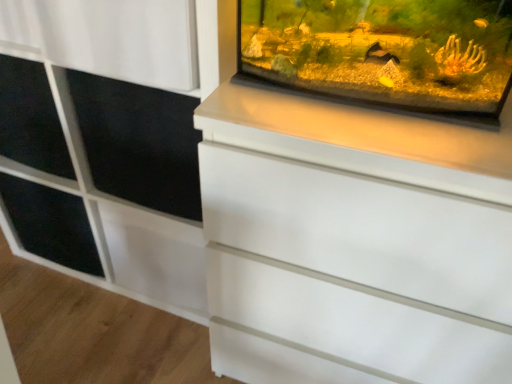
Find the location of a particular element. Image resolution: width=512 pixels, height=384 pixels. black matte shelf at left is located at coordinates (50, 224).

From the image's perspective, is transparent glass tank at upper right located above or below black matte shelf at left?

transparent glass tank at upper right is situated higher than black matte shelf at left in the image.

Is transparent glass tank at upper right further to camera compared to black matte shelf at left?

No, the depth of transparent glass tank at upper right is less than that of black matte shelf at left.

In terms of size, does transparent glass tank at upper right appear bigger or smaller than black matte shelf at left?

transparent glass tank at upper right is smaller than black matte shelf at left.

Which object is positioned more to the right, transparent glass tank at upper right or black matte shelf at left?

transparent glass tank at upper right is more to the right.

How many degrees apart are the facing directions of black matte screen door at upper left and white matte cabinet at upper right?

black matte screen door at upper left and white matte cabinet at upper right are facing 3.42 degrees away from each other.

Is black matte screen door at upper left thinner than white matte cabinet at upper right?

Yes.

Is black matte screen door at upper left bigger than white matte cabinet at upper right?

Incorrect, black matte screen door at upper left is not larger than white matte cabinet at upper right.

Is point (90, 168) positioned before point (366, 102)?

No, it is not.

Looking at this image, is black matte screen door at upper left turned away from transparent glass tank at upper right?

No, black matte screen door at upper left is not facing the opposite direction of transparent glass tank at upper right.

Locate an element on the screen. screen door above the black matte shelf at left (from the image's perspective) is located at coordinates (139, 142).

From the image's perspective, is black matte shelf at left under black matte screen door at upper left?

Yes, from the image's perspective, black matte shelf at left is below black matte screen door at upper left.

Which of these two, black matte shelf at left or black matte screen door at upper left, is wider?

With larger width is black matte screen door at upper left.

From a real-world perspective, is white matte cabinet at upper right located beneath black matte shelf at left?

No, from a real-world perspective, white matte cabinet at upper right is not under black matte shelf at left.

Is white matte cabinet at upper right positioned with its back to black matte shelf at left?

Correct, white matte cabinet at upper right is looking away from black matte shelf at left.

Where is `shelf behind the white matte cabinet at upper right`? This screenshot has height=384, width=512. shelf behind the white matte cabinet at upper right is located at coordinates (50, 224).

Is black matte shelf at left not near white matte cabinet at upper right?

black matte shelf at left is actually quite close to white matte cabinet at upper right.

Could white matte cabinet at upper right be considered to be inside black matte shelf at left?

No, white matte cabinet at upper right is not surrounded by black matte shelf at left.

Who is taller, black matte shelf at left or white matte cabinet at upper right?

white matte cabinet at upper right.

Are transparent glass tank at upper right and black matte screen door at upper left located far from each other?

No, transparent glass tank at upper right is not far away from black matte screen door at upper left.

Is transparent glass tank at upper right at the right side of black matte screen door at upper left?

Yes.

Does transparent glass tank at upper right have a smaller size compared to black matte screen door at upper left?

Correct, transparent glass tank at upper right occupies less space than black matte screen door at upper left.

Is transparent glass tank at upper right facing away from black matte screen door at upper left?

transparent glass tank at upper right does not have its back to black matte screen door at upper left.

Identify the location of glass box above the black matte shelf at left (from the image's perspective). The width and height of the screenshot is (512, 384). (383, 54).

Image resolution: width=512 pixels, height=384 pixels. Find the location of `screen door behind the white matte cabinet at upper right`. screen door behind the white matte cabinet at upper right is located at coordinates (139, 142).

Which object lies nearer to the anchor point black matte shelf at left, black matte screen door at upper left or white matte cabinet at upper right?

→ Based on the image, white matte cabinet at upper right appears to be nearer to black matte shelf at left.

Considering their positions, is transparent glass tank at upper right positioned closer to black matte shelf at left than black matte screen door at upper left?

black matte screen door at upper left is closer to black matte shelf at left.

From the image, which object appears to be nearer to white matte cabinet at upper right, black matte screen door at upper left or transparent glass tank at upper right?

black matte screen door at upper left lies closer to white matte cabinet at upper right than the other object.

Considering their positions, is black matte screen door at upper left positioned further to black matte shelf at left than transparent glass tank at upper right?

Based on the image, transparent glass tank at upper right appears to be further to black matte shelf at left.

Considering their positions, is black matte screen door at upper left positioned closer to transparent glass tank at upper right than white matte cabinet at upper right?

black matte screen door at upper left is positioned closer to the anchor transparent glass tank at upper right.

Based on their spatial positions, is transparent glass tank at upper right or white matte cabinet at upper right closer to black matte shelf at left?

white matte cabinet at upper right is closer to black matte shelf at left.

Which object lies nearer to the anchor point black matte shelf at left, white matte cabinet at upper right or black matte screen door at upper left?

Among the two, white matte cabinet at upper right is located nearer to black matte shelf at left.

Based on their spatial positions, is black matte screen door at upper left or black matte shelf at left further from transparent glass tank at upper right?

black matte shelf at left.

Where is `screen door between white matte cabinet at upper right and transparent glass tank at upper right in the horizontal direction`? This screenshot has height=384, width=512. screen door between white matte cabinet at upper right and transparent glass tank at upper right in the horizontal direction is located at coordinates (139, 142).

The width and height of the screenshot is (512, 384). What are the coordinates of `screen door located between black matte shelf at left and transparent glass tank at upper right in the left-right direction` in the screenshot? It's located at (x=139, y=142).

The image size is (512, 384). What are the coordinates of `screen door between white matte cabinet at upper right and black matte shelf at left in the front-back direction` in the screenshot? It's located at click(x=139, y=142).

What are the coordinates of `side cabinet between black matte shelf at left and transparent glass tank at upper right` in the screenshot? It's located at (106, 181).